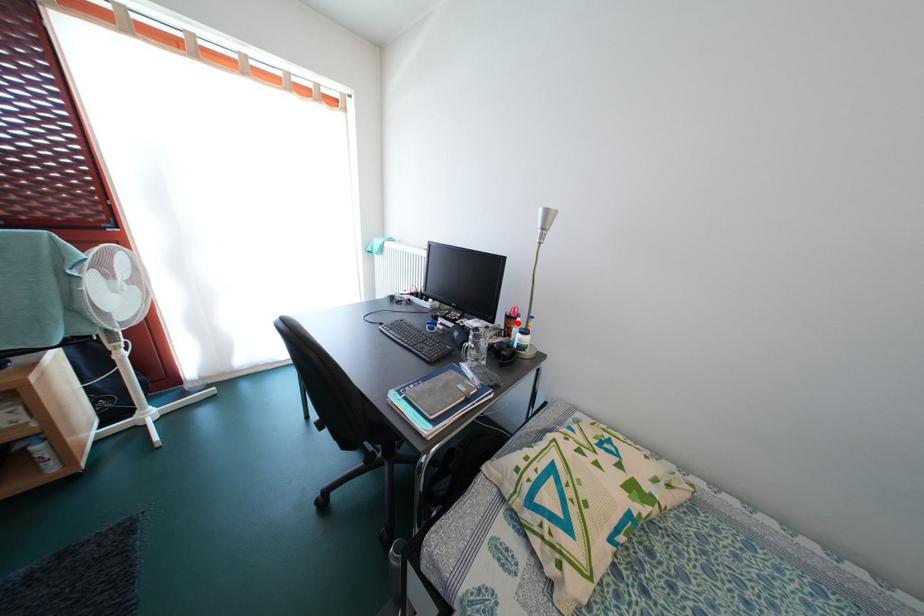
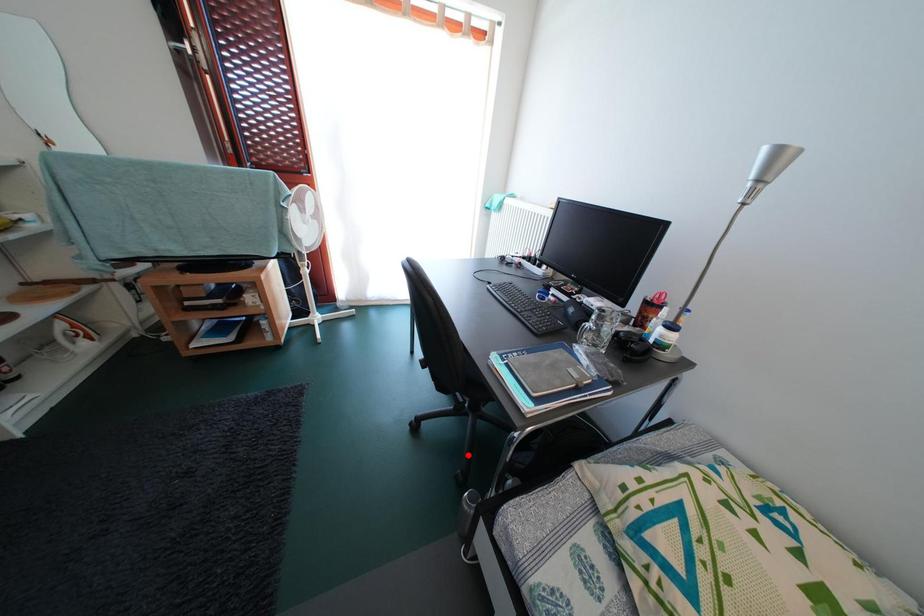
I am providing you with two images of the same scene from different viewpoints. A red point is marked on the first image and another point is marked on the second image. Does the point marked in image1 correspond to the same location as the one in image2?

No